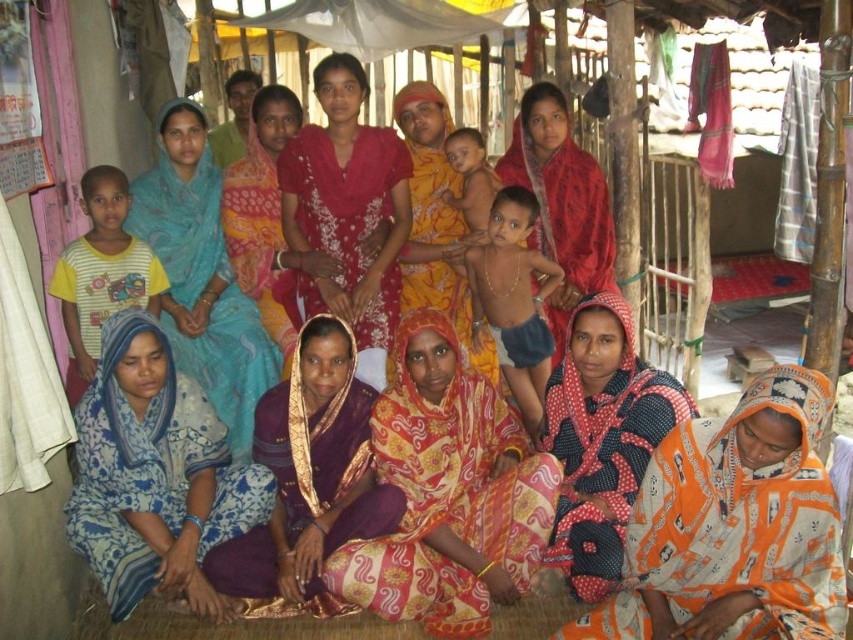
You are standing in the shelter and see two points marked in the scene. Which point is nearer to you, point (369, 515) or point (297, 164)?

Point (369, 515) is closer to the viewer than point (297, 164).

You are a photographer trying to capture a clear shot of the printed fabric saree at center and the light brown skin at center in the scene. Based on their positions, which object would you need to focus on first to ensure both are in focus?

The printed fabric saree at center is taller than light brown skin at center, so you should focus on the printed fabric saree at center first to ensure both are in focus.

You are standing at the entrance of the shelter and want to move towards the point labeled as point (798, 493). However, there is an obstacle located at point (287, 168). Will you encounter this obstacle on your way to the target point?

Since point (798, 493) is in front of point (287, 168), you will first reach the target point before encountering the obstacle at point (287, 168). Therefore, you will not encounter the obstacle on your way to the target point.